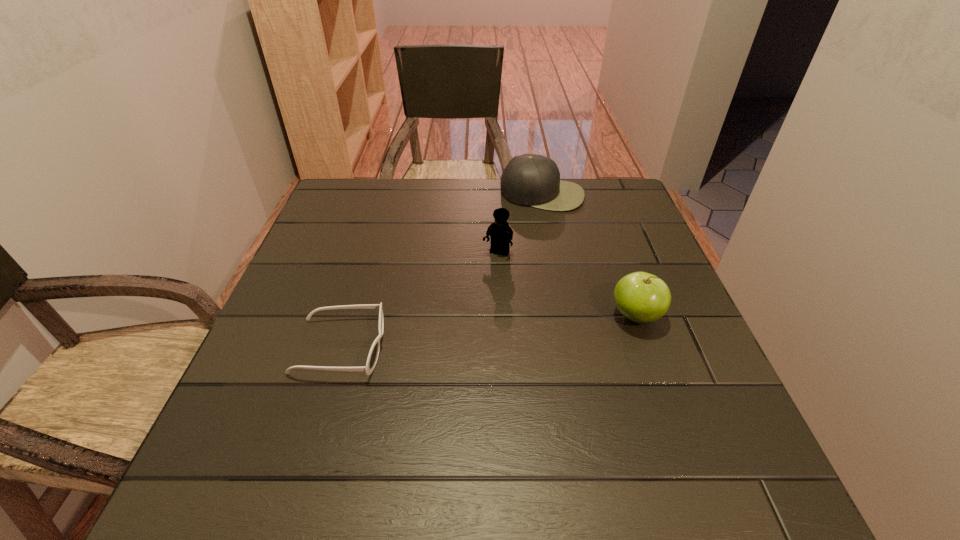
You are a GUI agent. You are given a task and a screenshot of the screen. Output one action in this format:
    pyautogui.click(x=<x>, y=<y>)
    Task: Click on the vacant region at the left edge of the desktop
    Image resolution: width=960 pixels, height=540 pixels.
    Given the screenshot: What is the action you would take?
    pos(359,272)

The height and width of the screenshot is (540, 960). Find the location of `free location at the right edge`. free location at the right edge is located at coordinates (694, 324).

In the image, there is a desktop. Where is `vacant space at the far left corner`? The image size is (960, 540). vacant space at the far left corner is located at coordinates (360, 204).

The height and width of the screenshot is (540, 960). Identify the location of free space at the near left corner. (253, 423).

You are a GUI agent. You are given a task and a screenshot of the screen. Output one action in this format:
    pyautogui.click(x=<x>, y=<y>)
    Task: Click on the vacant space at the far right corner
    Image resolution: width=960 pixels, height=540 pixels.
    Given the screenshot: What is the action you would take?
    pyautogui.click(x=629, y=188)

Locate an element on the screen. free space at the near right corner is located at coordinates (708, 421).

At what (x,y) coordinates should I click in order to perform the action: click on blank region between the cap and the shortest object. Please return your answer as a coordinate pair (x, y). Looking at the image, I should click on (442, 271).

The height and width of the screenshot is (540, 960). In order to click on vacant area that lies between the apple and the cap in this screenshot , I will do `click(589, 255)`.

I want to click on blank region between the Lego and the apple, so click(566, 285).

Where is `vacant space in between the apple and the cap`? vacant space in between the apple and the cap is located at coordinates (589, 255).